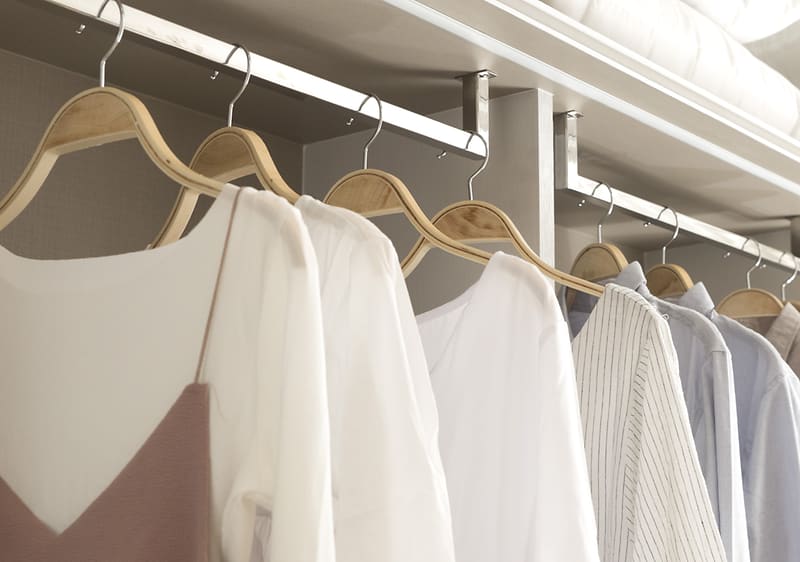
At what (x,y) coordinates should I click in order to perform the action: click on long sleeve garment on hanger. Please return your answer as a coordinate pair (x, y). Looking at the image, I should click on (269, 280), (360, 305), (502, 317), (618, 357), (712, 379), (765, 391), (790, 353).